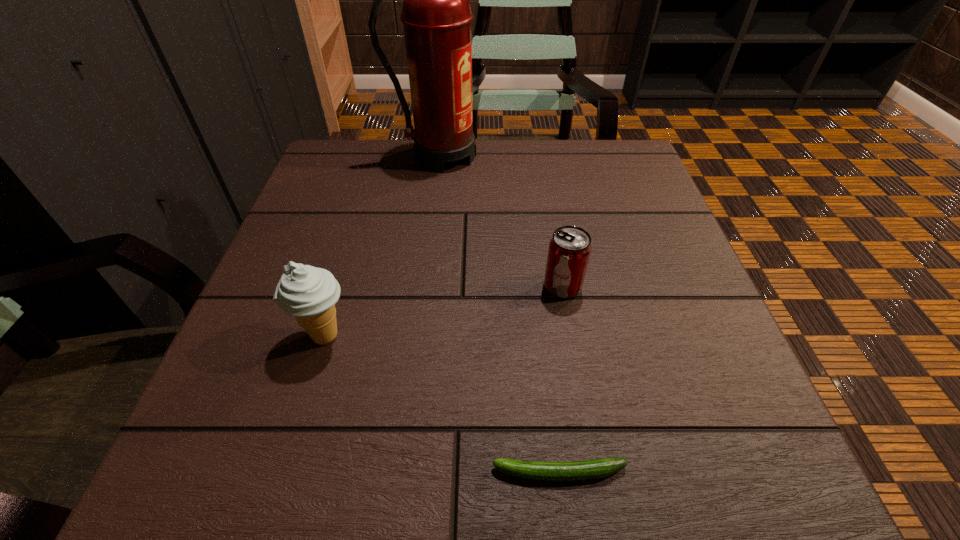
The height and width of the screenshot is (540, 960). In the image, there is a desktop. Find the location of `blank space at the right edge`. blank space at the right edge is located at coordinates (681, 330).

This screenshot has width=960, height=540. What are the coordinates of `free location at the far left corner of the desktop` in the screenshot? It's located at (369, 163).

The width and height of the screenshot is (960, 540). What are the coordinates of `vacant space that's between the second tallest object and the third nearest object` in the screenshot? It's located at (444, 311).

Locate an element on the screen. The height and width of the screenshot is (540, 960). free space between the nearest object and the second shortest object is located at coordinates (561, 379).

This screenshot has width=960, height=540. Find the location of `blank region between the third farthest object and the nearest object`. blank region between the third farthest object and the nearest object is located at coordinates (442, 404).

Where is `vacant region between the third nearest object and the farthest object`? This screenshot has height=540, width=960. vacant region between the third nearest object and the farthest object is located at coordinates (502, 221).

Identify the location of vacant area that lies between the third nearest object and the fire extinguisher. (502, 221).

At what (x,y) coordinates should I click in order to perform the action: click on free spot between the shortest object and the third nearest object. Please return your answer as a coordinate pair (x, y). The height and width of the screenshot is (540, 960). Looking at the image, I should click on click(x=561, y=379).

The image size is (960, 540). I want to click on empty location between the farthest object and the second shortest object, so click(x=502, y=221).

Where is `free space that is in between the second shortest object and the nearest object`? free space that is in between the second shortest object and the nearest object is located at coordinates (561, 379).